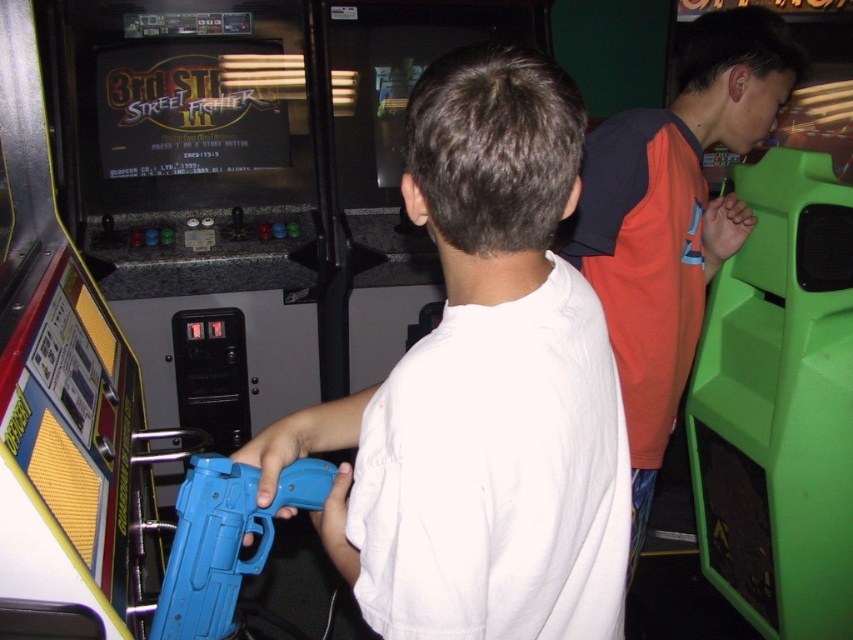
Question: Can you confirm if white matte shirt at center is wider than orange jersey at right?

Choices:
 (A) yes
 (B) no

Answer: (B)

Question: Does orange jersey at right appear on the right side of blue plastic toy gun at center?

Choices:
 (A) no
 (B) yes

Answer: (B)

Question: Among these points, which one is farthest from the camera?

Choices:
 (A) (247, 492)
 (B) (538, 564)
 (C) (606, 257)

Answer: (C)

Question: Which point appears closest to the camera in this image?

Choices:
 (A) click(759, 140)
 (B) click(401, 625)

Answer: (B)

Question: Considering the relative positions of white matte shirt at center and orange jersey at right in the image provided, where is white matte shirt at center located with respect to orange jersey at right?

Choices:
 (A) right
 (B) left

Answer: (B)

Question: Estimate the real-world distances between objects in this image. Which object is closer to the blue plastic toy gun at center?

Choices:
 (A) white matte shirt at center
 (B) orange jersey at right

Answer: (A)